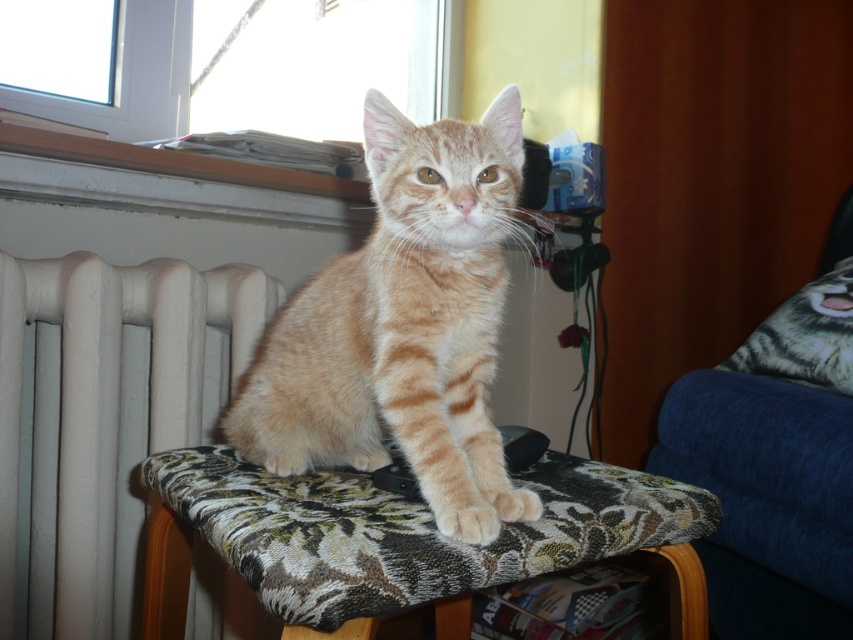
You are standing in the room and want to determine which of the two points, point (x=338, y=451) or point (x=99, y=268), is nearer to you. Based on the scene description, which point is closer?

Point (x=338, y=451) is closer to the viewer than point (x=99, y=268).

You are standing in the room and want to sit down on the blue fabric armchair at right. Based on its 2D location coordinates, can you estimate where you should walk to reach it?

The blue fabric armchair at right is located at the 2D coordinates point (x=766, y=499), so you should walk towards the right side of the room near the wall to reach it.